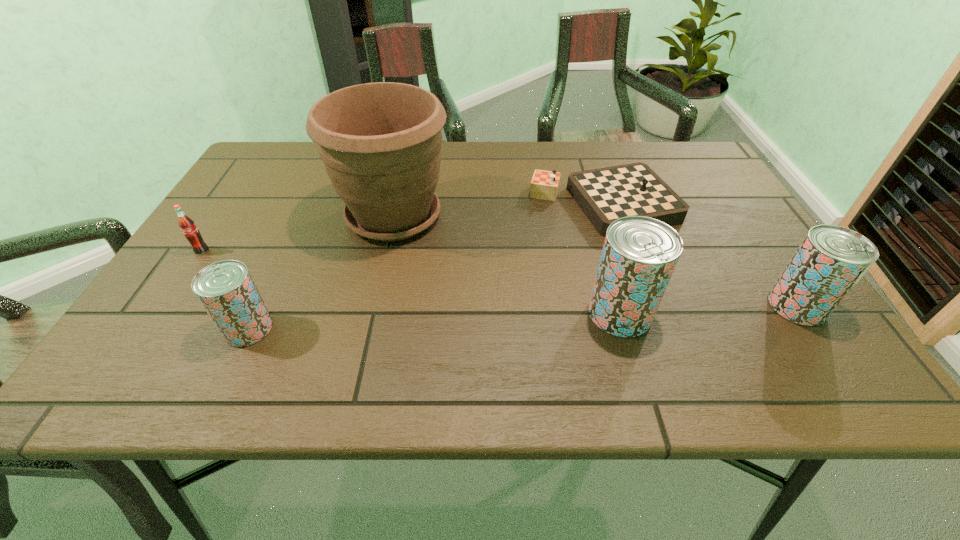
Identify the location of vacant region located on the back of the second beer can from left to right. (584, 190).

The image size is (960, 540). Identify the location of vacant space located on the left of the third tallest object. (581, 306).

I want to click on vacant area located on the label of the soda bottle, so click(168, 301).

You are a GUI agent. You are given a task and a screenshot of the screen. Output one action in this format:
    pyautogui.click(x=<x>, y=<y>)
    Task: Click on the blank space located on the front of the chessboard
    The width and height of the screenshot is (960, 540).
    Given the screenshot: What is the action you would take?
    pyautogui.click(x=642, y=320)

Image resolution: width=960 pixels, height=540 pixels. I want to click on vacant space located 0.270m on the right of the tallest object, so click(x=561, y=217).

I want to click on chessboard located in the far edge section of the desktop, so click(x=606, y=194).

The height and width of the screenshot is (540, 960). Find the location of `flowerpot at the far edge`. flowerpot at the far edge is located at coordinates (380, 143).

The height and width of the screenshot is (540, 960). Find the location of `object that is at the left edge`. object that is at the left edge is located at coordinates (186, 224).

The image size is (960, 540). I want to click on beer can located in the right edge section of the desktop, so click(831, 259).

I want to click on chessboard that is positioned at the right edge, so click(606, 194).